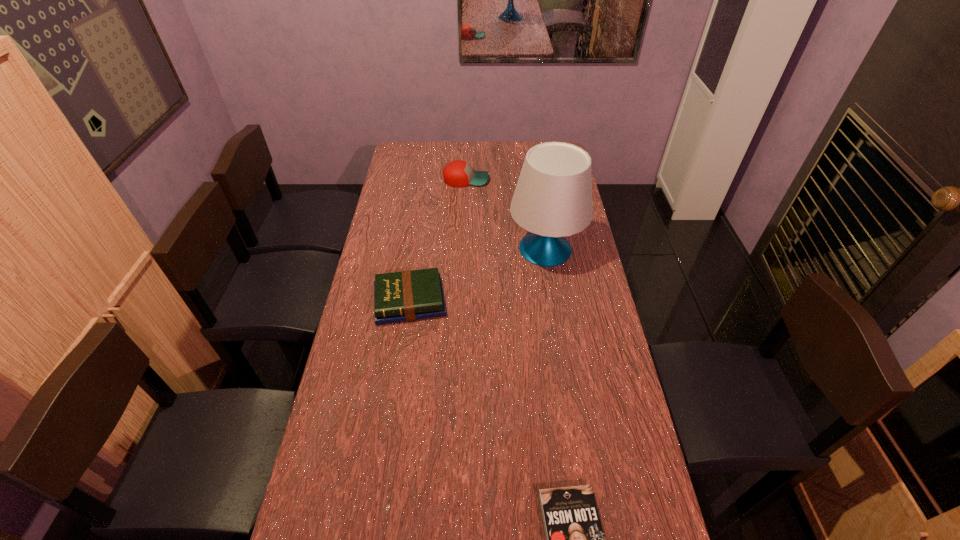
Find the location of a particular element. The image size is (960, 540). object that is at the right edge is located at coordinates (553, 198).

The height and width of the screenshot is (540, 960). In the image, there is a desktop. Identify the location of vacant space at the left edge. (402, 208).

You are a GUI agent. You are given a task and a screenshot of the screen. Output one action in this format:
    pyautogui.click(x=<x>, y=<y>)
    Task: Click on the vacant space at the right edge of the desktop
    This screenshot has height=540, width=960.
    Given the screenshot: What is the action you would take?
    pyautogui.click(x=558, y=283)

At what (x,y) coordinates should I click in order to perform the action: click on vacant space at the far right corner. Please return your answer as a coordinate pair (x, y). The height and width of the screenshot is (540, 960). Looking at the image, I should click on (540, 141).

The width and height of the screenshot is (960, 540). What are the coordinates of `unoccupied area between the second shortest object and the baseball cap` in the screenshot? It's located at (438, 240).

I want to click on empty space that is in between the tallest object and the taller book, so click(478, 275).

Locate an element on the screen. This screenshot has width=960, height=540. the second closest object to the baseball cap is located at coordinates (404, 296).

Identify which object is located as the nearest to the third tallest object. Please provide its 2D coordinates. Your answer should be formatted as a tuple, i.e. [(x, y)], where the tuple contains the x and y coordinates of a point satisfying the conditions above.

[(553, 198)]